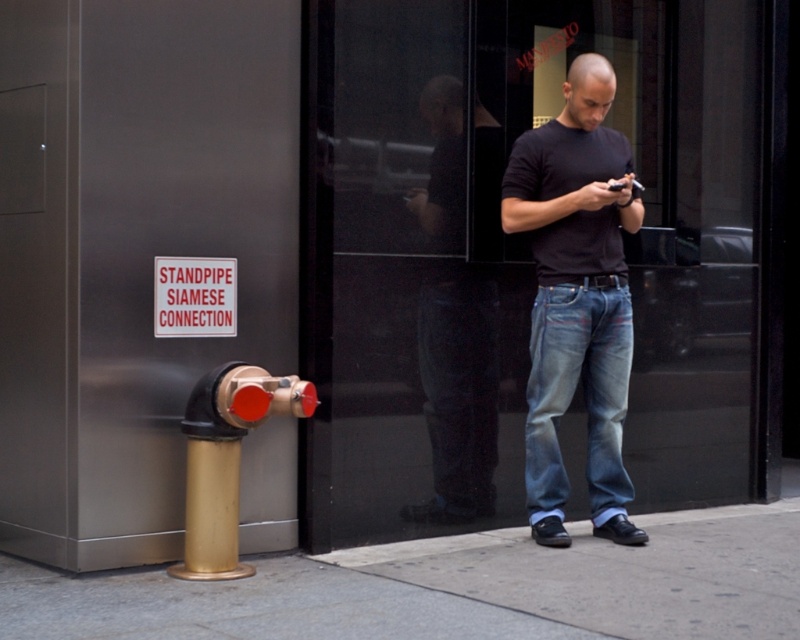
Does matte black shirt at center appear on the right side of gold metallic hydrant at lower left?

Yes, matte black shirt at center is to the right of gold metallic hydrant at lower left.

Between matte black shirt at center and gold metallic hydrant at lower left, which one is positioned lower?

gold metallic hydrant at lower left is below.

Who is more distant from viewer, (584, 316) or (230, 410)?

The point (584, 316) is behind.

Locate an element on the screen. matte black shirt at center is located at coordinates (576, 298).

Between smooth concrete pavement at lower center and gold metallic hydrant at lower left, which one has less height?

Standing shorter between the two is smooth concrete pavement at lower center.

Is smooth concrete pavement at lower center positioned before gold metallic hydrant at lower left?

Yes, it is.

Does point (189, 598) come closer to viewer compared to point (198, 557)?

Yes, point (189, 598) is in front of point (198, 557).

Locate an element on the screen. Image resolution: width=800 pixels, height=640 pixels. smooth concrete pavement at lower center is located at coordinates (456, 588).

Is dark blue jeans at center above denim jeans at center?

Correct, dark blue jeans at center is located above denim jeans at center.

Is point (430, 180) closer to camera compared to point (600, 468)?

No, it is behind (600, 468).

Which is in front, point (454, 516) or point (596, 374)?

Point (596, 374)

Where is `dark blue jeans at center`? Image resolution: width=800 pixels, height=640 pixels. dark blue jeans at center is located at coordinates (458, 390).